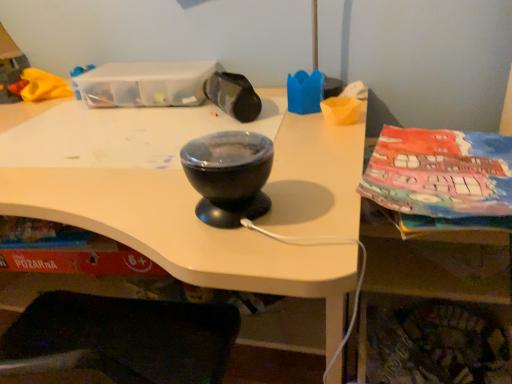
Question: Considering the positions of black glossy bowl at center and matte black bowl at center in the image, is black glossy bowl at center wider or thinner than matte black bowl at center?

Choices:
 (A) thin
 (B) wide

Answer: (B)

Question: From a real-world perspective, relative to matte black bowl at center, is black glossy bowl at center vertically above or below?

Choices:
 (A) below
 (B) above

Answer: (A)

Question: From their relative heights in the image, would you say black glossy bowl at center is taller or shorter than matte black bowl at center?

Choices:
 (A) short
 (B) tall

Answer: (B)

Question: Considering the positions of point (222, 226) and point (313, 198), is point (222, 226) closer or farther from the camera than point (313, 198)?

Choices:
 (A) closer
 (B) farther

Answer: (A)

Question: From a real-world perspective, is matte black bowl at center above or below black glossy bowl at center?

Choices:
 (A) above
 (B) below

Answer: (A)

Question: In terms of size, does matte black bowl at center appear bigger or smaller than black glossy bowl at center?

Choices:
 (A) big
 (B) small

Answer: (B)

Question: In the image, is matte black bowl at center positioned in front of or behind black glossy bowl at center?

Choices:
 (A) behind
 (B) front

Answer: (A)